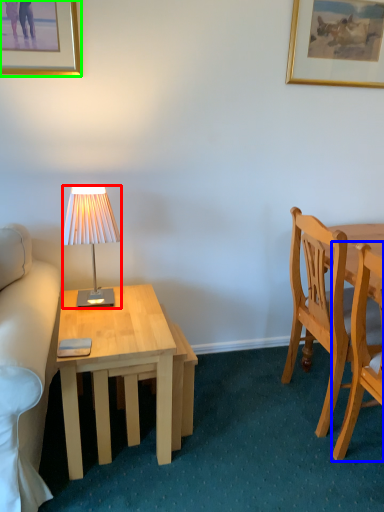
Question: Considering the real-world distances, which object is closest to lamp (highlighted by a red box)? chair (highlighted by a blue box) or picture frame (highlighted by a green box).

Choices:
 (A) chair
 (B) picture frame

Answer: (B)